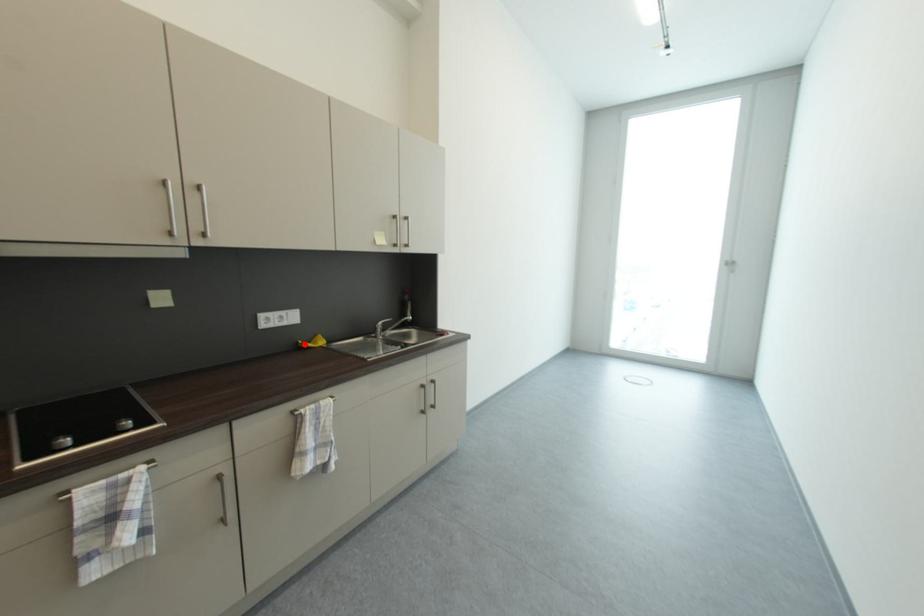
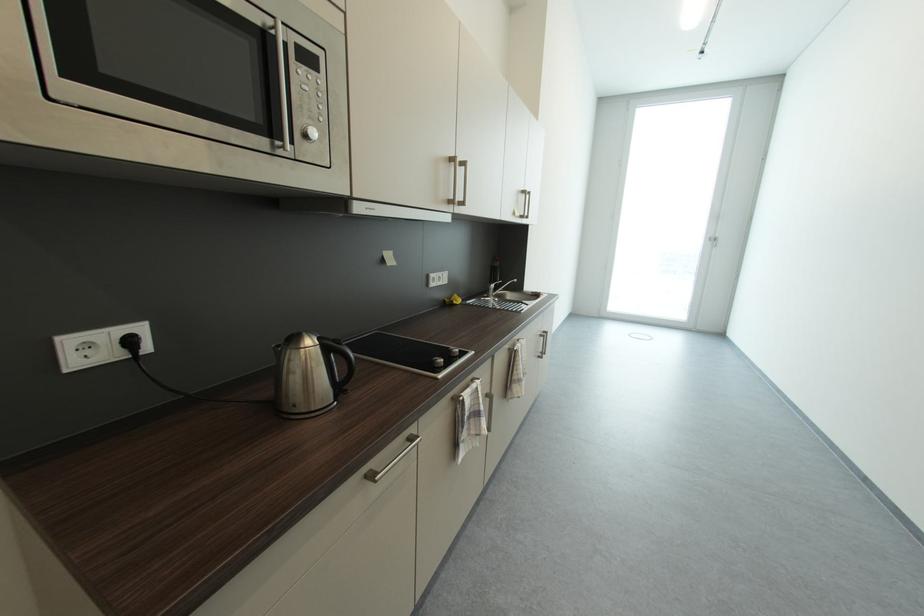
The point at the highlighted location is marked in the first image. Where is the corresponding point in the second image?

(453, 302)